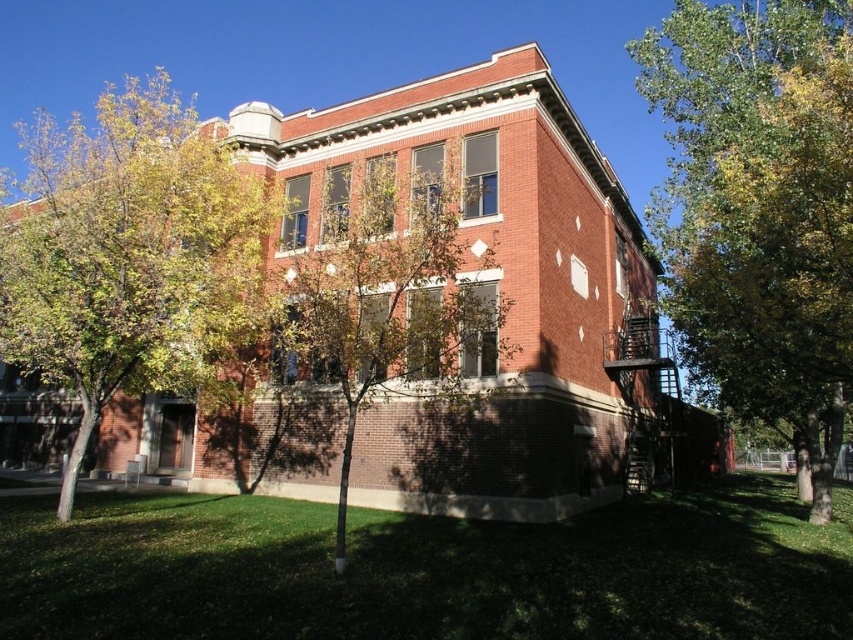
Question: Is green leafy tree at right below green leafy tree at lower left?

Choices:
 (A) no
 (B) yes

Answer: (B)

Question: Which point appears farthest from the camera in this image?

Choices:
 (A) (787, 317)
 (B) (289, 324)
 (C) (193, 352)

Answer: (C)

Question: Which is farther from the green leafy tree at lower left?

Choices:
 (A) green leafy tree at right
 (B) green leafy tree at center

Answer: (A)

Question: Does green leafy tree at right appear over green leafy tree at center?

Choices:
 (A) yes
 (B) no

Answer: (A)

Question: Is green leafy tree at right to the left of green leafy tree at lower left from the viewer's perspective?

Choices:
 (A) no
 (B) yes

Answer: (A)

Question: Which of the following is the closest to the observer?

Choices:
 (A) green leafy tree at lower left
 (B) green leafy tree at center

Answer: (B)